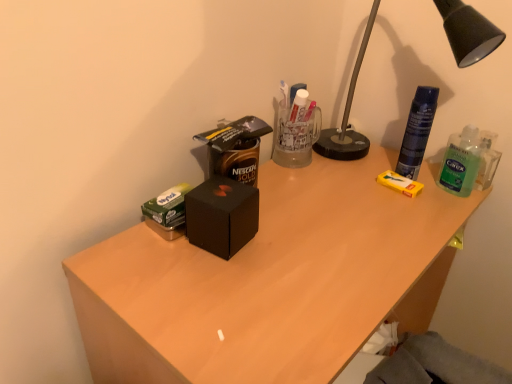
This screenshot has width=512, height=384. Identify the location of free point behind black matte box at center. (281, 188).